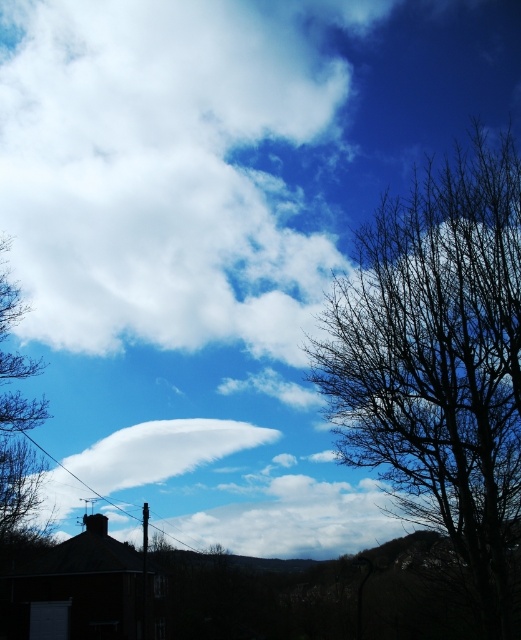
You are a bird seeking shelter. You see the bare branches at right and the brown leafless tree at left. Which tree would provide more coverage for nesting?

The brown leafless tree at left is taller than the bare branches at right, so it would provide more coverage for nesting.

You are an astronomer analyzing the image of the sky. You notice a point marked at coordinates (x=167, y=449). Based on the scene description, what celestial object is located at this point?

The point at (x=167, y=449) marks a white fluffy cloud at center, which is a lenticular cloud often associated with mountainous regions.

You are a bird flying in the sky and want to land on the brown leafless tree at left. From your current position above the white fluffy cloud at center, which direction should you fly to reach the tree?

The white fluffy cloud at center is positioned under the brown leafless tree at left, so you should fly upward to reach the tree.